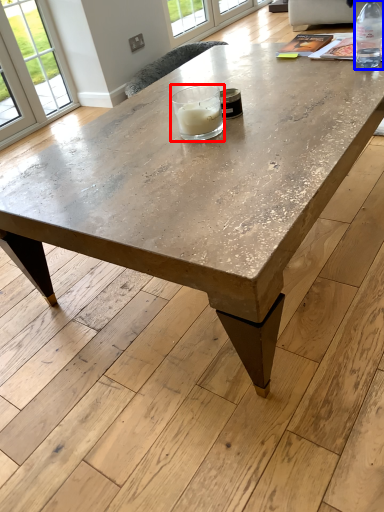
Question: Which point is closer to the camera, candle holder (highlighted by a red box) or bottle (highlighted by a blue box)?

Choices:
 (A) candle holder
 (B) bottle

Answer: (A)